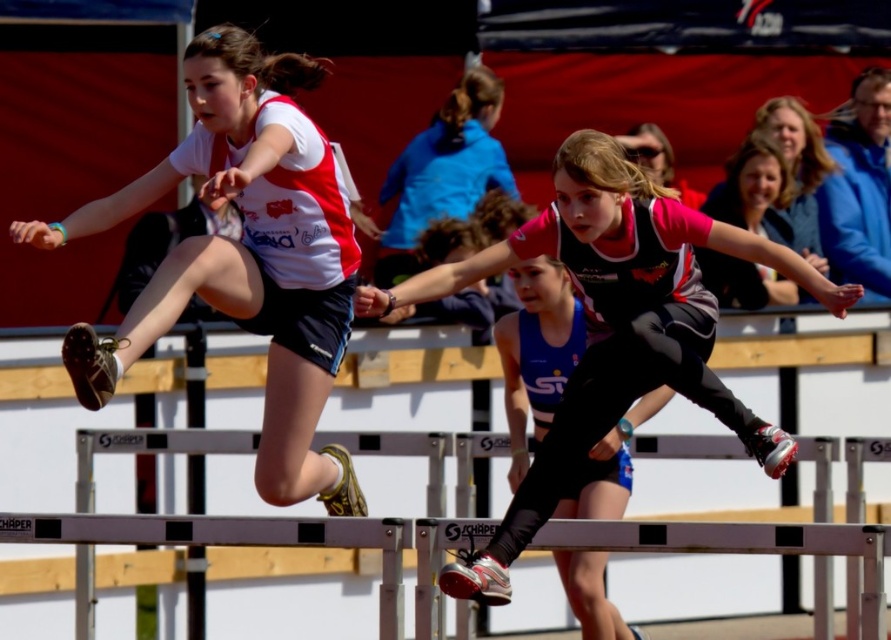
Question: Which object appears farthest from the camera in this image?

Choices:
 (A) matte black shorts at center
 (B) white matte shorts at left

Answer: (A)

Question: Which point appears closest to the camera in this image?

Choices:
 (A) (716, 225)
 (B) (208, 243)

Answer: (B)

Question: From the image, what is the correct spatial relationship of white matte shorts at left in relation to matte black shorts at center?

Choices:
 (A) right
 (B) left

Answer: (B)

Question: In this image, where is white matte shorts at left located relative to matte black shorts at center?

Choices:
 (A) above
 (B) below

Answer: (A)

Question: Does white matte shorts at left appear under matte black shorts at center?

Choices:
 (A) no
 (B) yes

Answer: (A)